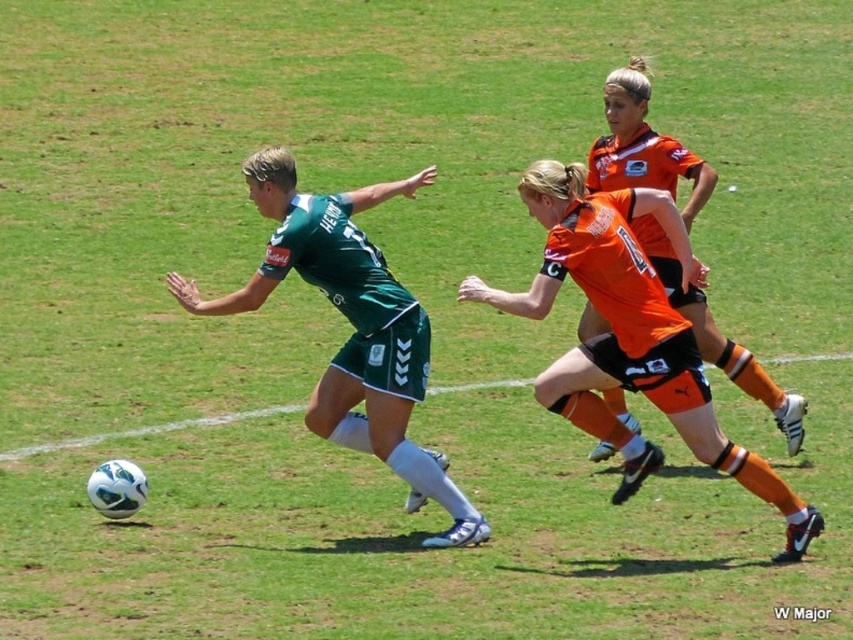
Question: Which point is farther to the camera?

Choices:
 (A) (675, 300)
 (B) (445, 476)

Answer: (A)

Question: Can you confirm if green matte jersey at center is bigger than orange matte jersey at center?

Choices:
 (A) yes
 (B) no

Answer: (A)

Question: Is green matte jersey at center to the right of orange matte jersey at center from the viewer's perspective?

Choices:
 (A) no
 (B) yes

Answer: (A)

Question: Observing the image, what is the correct spatial positioning of green matte jersey at center in reference to orange matte jersey at center?

Choices:
 (A) above
 (B) below

Answer: (B)